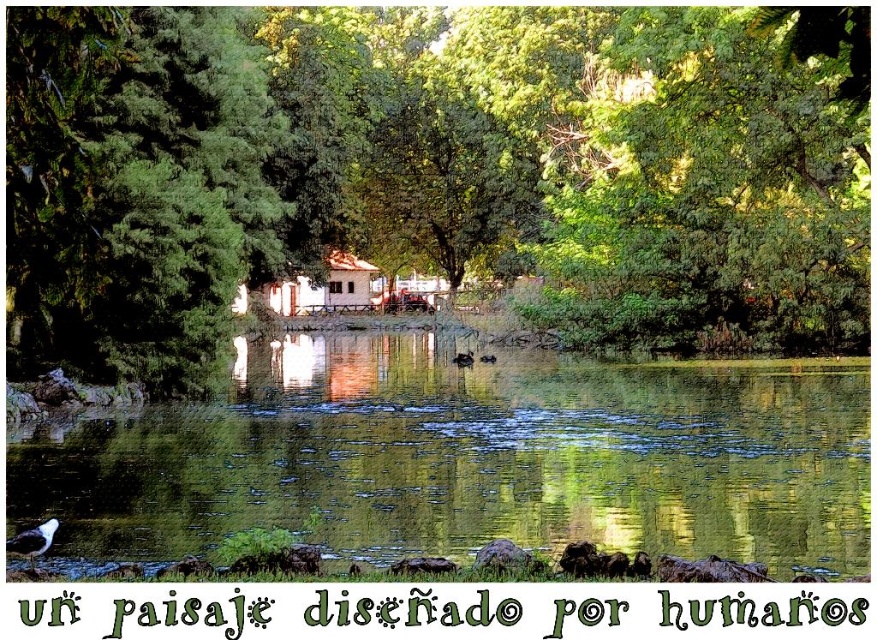
Question: Which object is positioned closest to the green leafy tree at center?

Choices:
 (A) green reflective water at center
 (B) white wooden hut at center

Answer: (A)

Question: Among these points, which one is nearest to the camera?

Choices:
 (A) (346, 308)
 (B) (669, 493)
 (C) (240, 205)

Answer: (B)

Question: Can you confirm if green leafy tree at center is thinner than white wooden hut at center?

Choices:
 (A) yes
 (B) no

Answer: (B)

Question: Can you confirm if green leafy tree at center is wider than green reflective water at center?

Choices:
 (A) no
 (B) yes

Answer: (B)

Question: Observing the image, what is the correct spatial positioning of green leafy tree at center in reference to green reflective water at center?

Choices:
 (A) below
 (B) above

Answer: (B)

Question: Which object is the closest to the green reflective water at center?

Choices:
 (A) white wooden hut at center
 (B) green leafy tree at center

Answer: (B)